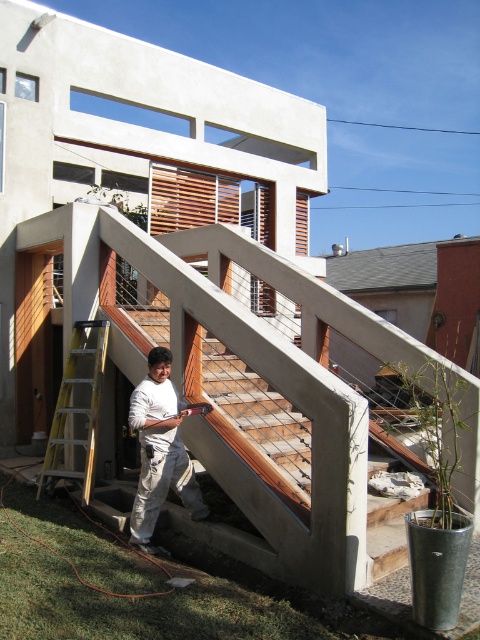
Question: In this image, where is white matte shirt at center located relative to yellow/yellowish metallic ladder at lower left?

Choices:
 (A) left
 (B) right

Answer: (B)

Question: Can you confirm if wooden at center is positioned above yellow/yellowish metallic ladder at lower left?

Choices:
 (A) no
 (B) yes

Answer: (B)

Question: Which point is farther to the camera?

Choices:
 (A) wooden at center
 (B) white matte shirt at center

Answer: (B)

Question: Which is nearer to the yellow/yellowish metallic ladder at lower left?

Choices:
 (A) wooden at center
 (B) white matte shirt at center

Answer: (B)

Question: In this image, where is wooden at center located relative to white matte shirt at center?

Choices:
 (A) above
 (B) below

Answer: (A)

Question: Based on their relative distances, which object is farther from the yellow/yellowish metallic ladder at lower left?

Choices:
 (A) white matte shirt at center
 (B) wooden at center

Answer: (B)